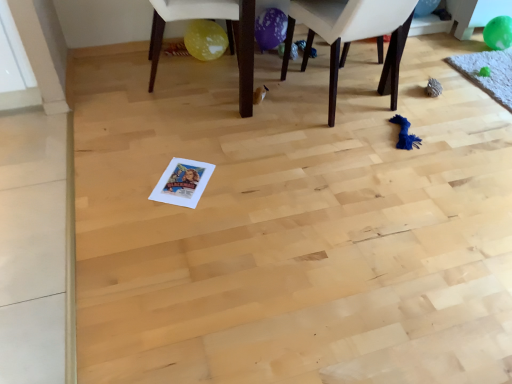
Locate an element on the screen. The width and height of the screenshot is (512, 384). dark brown wooden chair at center, placed as the 1th chair when sorted from right to left is located at coordinates (353, 36).

How much space does green rubber balloon at upper right, marked as the first balloon in a left-to-right arrangement, occupy vertically?

The height of green rubber balloon at upper right, marked as the first balloon in a left-to-right arrangement, is 4.93 inches.

This screenshot has width=512, height=384. In order to click on green rubber balloon at upper right, which appears as the first balloon when viewed from the top in this screenshot , I will do `click(425, 7)`.

At what (x,y) coordinates should I click in order to perform the action: click on dark brown wooden chair at center, positioned as the 2th chair in left-to-right order. Please return your answer as a coordinate pair (x, y). The width and height of the screenshot is (512, 384). Looking at the image, I should click on (353, 36).

Is dark brown wooden chair at center, placed as the 1th chair when sorted from right to left, spatially inside green rubber balloon at upper right, placed as the second balloon when sorted from right to left, or outside of it?

dark brown wooden chair at center, placed as the 1th chair when sorted from right to left, is spatially situated outside green rubber balloon at upper right, placed as the second balloon when sorted from right to left.

From the image's perspective, which one is positioned higher, dark brown wooden chair at center, placed as the 1th chair when sorted from right to left, or green rubber balloon at upper right, placed as the second balloon when sorted from right to left?

green rubber balloon at upper right, placed as the second balloon when sorted from right to left, appears higher in the image.

Looking at this image, is dark brown wooden chair at center, placed as the 1th chair when sorted from right to left, smaller than green rubber balloon at upper right, the 2th balloon when ordered from bottom to top?

No.

The height and width of the screenshot is (384, 512). I want to click on the 1st balloon counting from the right side of the dark brown wooden chair at center, placed as the 1th chair when sorted from right to left, so click(x=425, y=7).

Looking at this image, is green rubber balloon at upper right, arranged as the 2th balloon when viewed from the left, aimed at green rubber balloon at upper right, which appears as the first balloon when viewed from the top?

No, green rubber balloon at upper right, arranged as the 2th balloon when viewed from the left, does not turn towards green rubber balloon at upper right, which appears as the first balloon when viewed from the top.

The width and height of the screenshot is (512, 384). In order to click on balloon that is below the green rubber balloon at upper right, which appears as the first balloon when viewed from the top (from the image's perspective) in this screenshot , I will do `click(498, 33)`.

Is green rubber balloon at upper right, arranged as the 2th balloon when viewed from the left, not near green rubber balloon at upper right, placed as the second balloon when sorted from right to left?

No.

How much distance is there between green rubber balloon at upper right, the second balloon when ordered from top to bottom, and dark brown wooden chair at center, placed as the 1th chair when sorted from right to left?

1.25 meters.

Is green rubber balloon at upper right, which is counted as the 1th balloon, starting from the bottom, in contact with dark brown wooden chair at center, positioned as the 2th chair in left-to-right order?

No.

From the image's perspective, is green rubber balloon at upper right, placed as the first balloon when sorted from right to left, on top of dark brown wooden chair at center, placed as the 1th chair when sorted from right to left?

Yes, from the image's perspective, green rubber balloon at upper right, placed as the first balloon when sorted from right to left, is over dark brown wooden chair at center, placed as the 1th chair when sorted from right to left.

Considering the relative positions of green rubber balloon at upper right, which appears as the first balloon when viewed from the top, and yellow matte balloon under chair at center, positioned as the first chair in left-to-right order, in the image provided, is green rubber balloon at upper right, which appears as the first balloon when viewed from the top, to the left of yellow matte balloon under chair at center, positioned as the first chair in left-to-right order, from the viewer's perspective?

No.

Measure the distance from green rubber balloon at upper right, which appears as the first balloon when viewed from the top, to yellow matte balloon under chair at center, positioned as the first chair in left-to-right order.

green rubber balloon at upper right, which appears as the first balloon when viewed from the top, is 5.15 feet from yellow matte balloon under chair at center, positioned as the first chair in left-to-right order.

Can you confirm if green rubber balloon at upper right, marked as the first balloon in a left-to-right arrangement, is bigger than yellow matte balloon under chair at center, the 2th chair positioned from the right?

No, green rubber balloon at upper right, marked as the first balloon in a left-to-right arrangement, is not bigger than yellow matte balloon under chair at center, the 2th chair positioned from the right.

Does point (428, 10) appear closer or farther from the camera than point (177, 11)?

Point (428, 10) is farther from the camera than point (177, 11).

From the image's perspective, between green rubber balloon at upper right, which appears as the first balloon when viewed from the top, and dark brown wooden chair at center, placed as the 1th chair when sorted from right to left, who is located below?

dark brown wooden chair at center, placed as the 1th chair when sorted from right to left, is shown below in the image.

Who is smaller, green rubber balloon at upper right, which appears as the first balloon when viewed from the top, or dark brown wooden chair at center, placed as the 1th chair when sorted from right to left?

green rubber balloon at upper right, which appears as the first balloon when viewed from the top.

Does green rubber balloon at upper right, placed as the second balloon when sorted from right to left, appear on the right side of dark brown wooden chair at center, placed as the 1th chair when sorted from right to left?

Indeed, green rubber balloon at upper right, placed as the second balloon when sorted from right to left, is positioned on the right side of dark brown wooden chair at center, placed as the 1th chair when sorted from right to left.

From the image's perspective, which chair is the 2nd one below the green rubber balloon at upper right, the 2th balloon when ordered from bottom to top? Please provide its 2D coordinates.

[(353, 36)]

Is dark brown wooden chair at center, positioned as the 2th chair in left-to-right order, positioned with its back to yellow matte balloon under chair at center, positioned as the first chair in left-to-right order?

No, dark brown wooden chair at center, positioned as the 2th chair in left-to-right order,'s orientation is not away from yellow matte balloon under chair at center, positioned as the first chair in left-to-right order.

Is dark brown wooden chair at center, positioned as the 2th chair in left-to-right order, to the left or to the right of yellow matte balloon under chair at center, positioned as the first chair in left-to-right order, in the image?

In the image, dark brown wooden chair at center, positioned as the 2th chair in left-to-right order, appears on the right side of yellow matte balloon under chair at center, positioned as the first chair in left-to-right order.

Is dark brown wooden chair at center, positioned as the 2th chair in left-to-right order, not within yellow matte balloon under chair at center, positioned as the first chair in left-to-right order?

Yes.

From the picture: Is dark brown wooden chair at center, placed as the 1th chair when sorted from right to left, bigger or smaller than yellow matte balloon under chair at center, positioned as the first chair in left-to-right order?

Clearly, dark brown wooden chair at center, placed as the 1th chair when sorted from right to left, is larger in size than yellow matte balloon under chair at center, positioned as the first chair in left-to-right order.

Relative to green rubber balloon at upper right, placed as the first balloon when sorted from right to left, is green rubber balloon at upper right, the 2th balloon when ordered from bottom to top, in front or behind?

Clearly, green rubber balloon at upper right, the 2th balloon when ordered from bottom to top, is behind green rubber balloon at upper right, placed as the first balloon when sorted from right to left.

From their relative heights in the image, would you say green rubber balloon at upper right, placed as the second balloon when sorted from right to left, is taller or shorter than green rubber balloon at upper right, which is counted as the 1th balloon, starting from the bottom?

Considering their sizes, green rubber balloon at upper right, placed as the second balloon when sorted from right to left, has less height than green rubber balloon at upper right, which is counted as the 1th balloon, starting from the bottom.

Considering the relative sizes of green rubber balloon at upper right, marked as the first balloon in a left-to-right arrangement, and green rubber balloon at upper right, which is counted as the 1th balloon, starting from the bottom, in the image provided, is green rubber balloon at upper right, marked as the first balloon in a left-to-right arrangement, wider than green rubber balloon at upper right, which is counted as the 1th balloon, starting from the bottom,?

In fact, green rubber balloon at upper right, marked as the first balloon in a left-to-right arrangement, might be narrower than green rubber balloon at upper right, which is counted as the 1th balloon, starting from the bottom.

From a real-world perspective, which is physically below, green rubber balloon at upper right, marked as the first balloon in a left-to-right arrangement, or green rubber balloon at upper right, placed as the first balloon when sorted from right to left?

green rubber balloon at upper right, placed as the first balloon when sorted from right to left.

There is a green rubber balloon at upper right, which appears as the first balloon when viewed from the top. Identify the location of the 2nd chair above it (from a real-world perspective). (353, 36).

What are the coordinates of `balloon on the left of green rubber balloon at upper right, which is counted as the 1th balloon, starting from the bottom` in the screenshot? It's located at (425, 7).

Looking at the image, which one is located closer to green rubber balloon at upper right, placed as the first balloon when sorted from right to left, dark brown wooden chair at center, placed as the 1th chair when sorted from right to left, or green rubber balloon at upper right, the 2th balloon when ordered from bottom to top?

green rubber balloon at upper right, the 2th balloon when ordered from bottom to top, is positioned closer to the anchor green rubber balloon at upper right, placed as the first balloon when sorted from right to left.

When comparing their distances from green rubber balloon at upper right, placed as the second balloon when sorted from right to left, does dark brown wooden chair at center, placed as the 1th chair when sorted from right to left, or green rubber balloon at upper right, placed as the first balloon when sorted from right to left, seem further?

dark brown wooden chair at center, placed as the 1th chair when sorted from right to left, lies further to green rubber balloon at upper right, placed as the second balloon when sorted from right to left, than the other object.

Based on the photo, estimate the real-world distances between objects in this image. Which object is further from dark brown wooden chair at center, placed as the 1th chair when sorted from right to left, yellow matte balloon under chair at center, the 2th chair positioned from the right, or green rubber balloon at upper right, placed as the second balloon when sorted from right to left?

green rubber balloon at upper right, placed as the second balloon when sorted from right to left.

Considering their positions, is yellow matte balloon under chair at center, positioned as the first chair in left-to-right order, positioned further to dark brown wooden chair at center, placed as the 1th chair when sorted from right to left, than green rubber balloon at upper right, the second balloon when ordered from top to bottom?

green rubber balloon at upper right, the second balloon when ordered from top to bottom, is further to dark brown wooden chair at center, placed as the 1th chair when sorted from right to left.

Considering their positions, is dark brown wooden chair at center, placed as the 1th chair when sorted from right to left, positioned further to green rubber balloon at upper right, the second balloon when ordered from top to bottom, than yellow matte balloon under chair at center, positioned as the first chair in left-to-right order?

The object further to green rubber balloon at upper right, the second balloon when ordered from top to bottom, is yellow matte balloon under chair at center, positioned as the first chair in left-to-right order.

From the image, which object appears to be farther from yellow matte balloon under chair at center, the 2th chair positioned from the right, dark brown wooden chair at center, placed as the 1th chair when sorted from right to left, or green rubber balloon at upper right, marked as the first balloon in a left-to-right arrangement?

The object further to yellow matte balloon under chair at center, the 2th chair positioned from the right, is green rubber balloon at upper right, marked as the first balloon in a left-to-right arrangement.

From the image, which object appears to be farther from dark brown wooden chair at center, positioned as the 2th chair in left-to-right order, green rubber balloon at upper right, which appears as the first balloon when viewed from the top, or green rubber balloon at upper right, which is counted as the 1th balloon, starting from the bottom?

Among the two, green rubber balloon at upper right, which is counted as the 1th balloon, starting from the bottom, is located further to dark brown wooden chair at center, positioned as the 2th chair in left-to-right order.

From the image, which object appears to be nearer to yellow matte balloon under chair at center, the 2th chair positioned from the right, dark brown wooden chair at center, positioned as the 2th chair in left-to-right order, or green rubber balloon at upper right, placed as the first balloon when sorted from right to left?

dark brown wooden chair at center, positioned as the 2th chair in left-to-right order, lies closer to yellow matte balloon under chair at center, the 2th chair positioned from the right, than the other object.

Where is `balloon between yellow matte balloon under chair at center, the 2th chair positioned from the right, and green rubber balloon at upper right, the second balloon when ordered from top to bottom, from left to right`? Image resolution: width=512 pixels, height=384 pixels. balloon between yellow matte balloon under chair at center, the 2th chair positioned from the right, and green rubber balloon at upper right, the second balloon when ordered from top to bottom, from left to right is located at coordinates (425, 7).

What are the coordinates of `chair between yellow matte balloon under chair at center, positioned as the first chair in left-to-right order, and green rubber balloon at upper right, the second balloon when ordered from top to bottom, from left to right` in the screenshot? It's located at (353, 36).

Where is `balloon located between dark brown wooden chair at center, placed as the 1th chair when sorted from right to left, and green rubber balloon at upper right, which appears as the first balloon when viewed from the top, in the depth direction`? balloon located between dark brown wooden chair at center, placed as the 1th chair when sorted from right to left, and green rubber balloon at upper right, which appears as the first balloon when viewed from the top, in the depth direction is located at coordinates (498, 33).

This screenshot has width=512, height=384. In order to click on chair located between yellow matte balloon under chair at center, the 2th chair positioned from the right, and green rubber balloon at upper right, placed as the second balloon when sorted from right to left, in the left-right direction in this screenshot , I will do `click(353, 36)`.